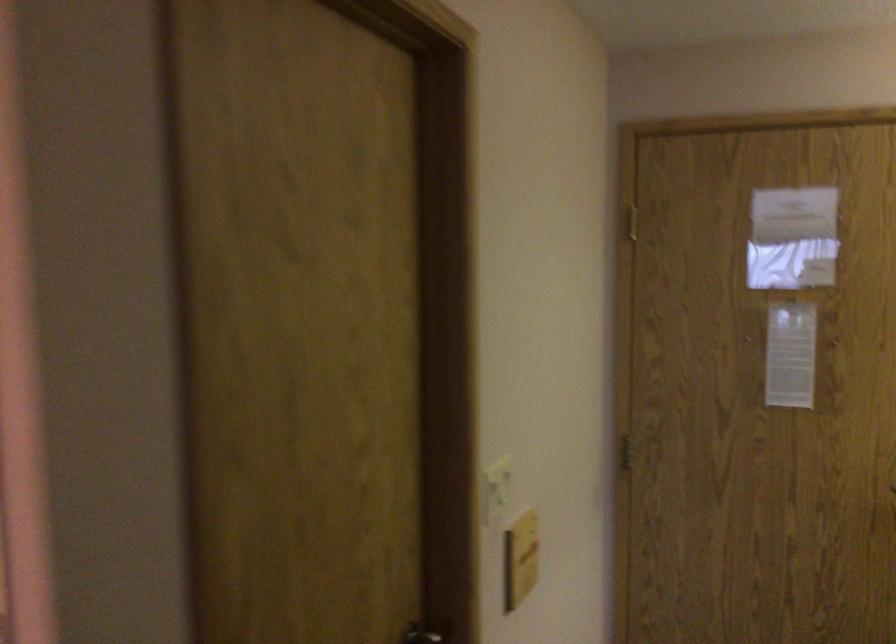
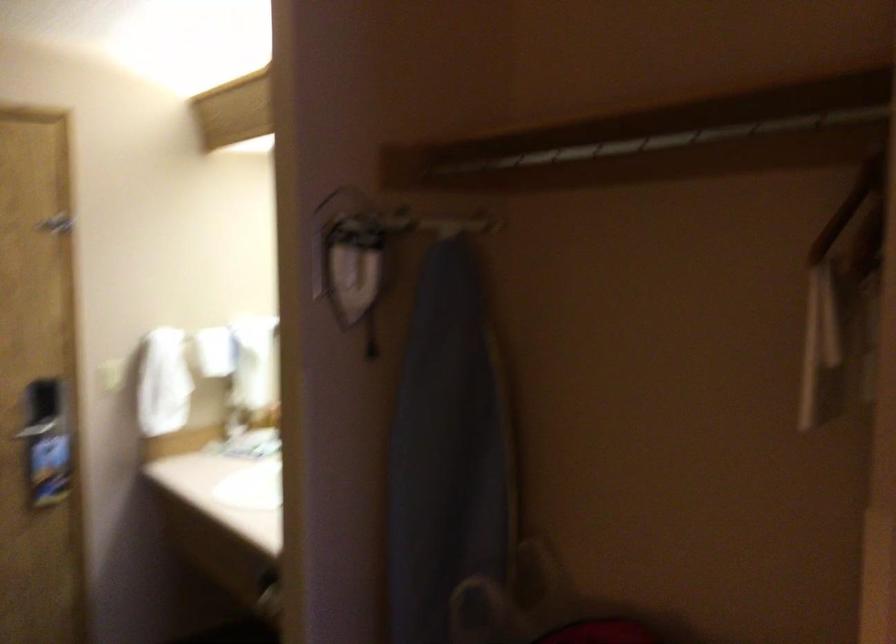
Question: The camera is either moving clockwise (left) or counter-clockwise (right) around the object. The first image is from the beginning of the video and the second image is from the end. Is the camera moving left or right when shooting the video?

Choices:
 (A) Left
 (B) Right

Answer: (A)